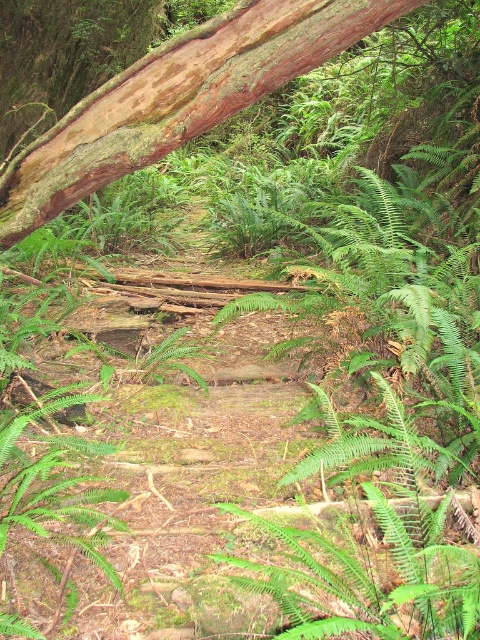
Does green leafy fern at center appear on the left side of green leafy fern at lower left?

Incorrect, green leafy fern at center is not on the left side of green leafy fern at lower left.

Is green leafy fern at center taller than green leafy fern at lower left?

Correct, green leafy fern at center is much taller as green leafy fern at lower left.

This screenshot has height=640, width=480. I want to click on green leafy fern at center, so click(371, 544).

Which is more to the right, brown rough bark tree trunk at upper left or green leafy fern at center?

From the viewer's perspective, green leafy fern at center appears more on the right side.

Is point (365, 6) behind point (330, 596)?

Yes.

The height and width of the screenshot is (640, 480). I want to click on brown rough bark tree trunk at upper left, so click(x=179, y=99).

Measure the distance between brown rough bark tree trunk at upper left and green leafy fern at lower left.

3.64 feet

The height and width of the screenshot is (640, 480). I want to click on brown rough bark tree trunk at upper left, so click(x=179, y=99).